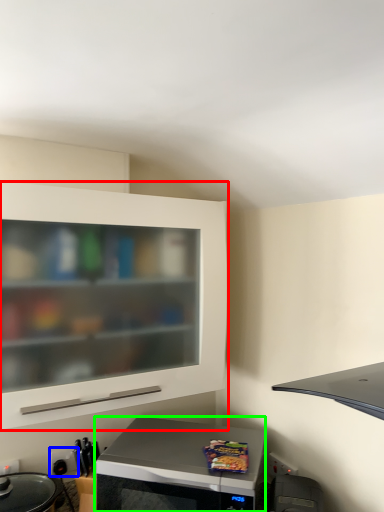
Question: Considering the real-world distances, which object is farthest from cabinetry (highlighted by a red box)? electric outlet (highlighted by a blue box) or microwave oven (highlighted by a green box)?

Choices:
 (A) electric outlet
 (B) microwave oven

Answer: (A)